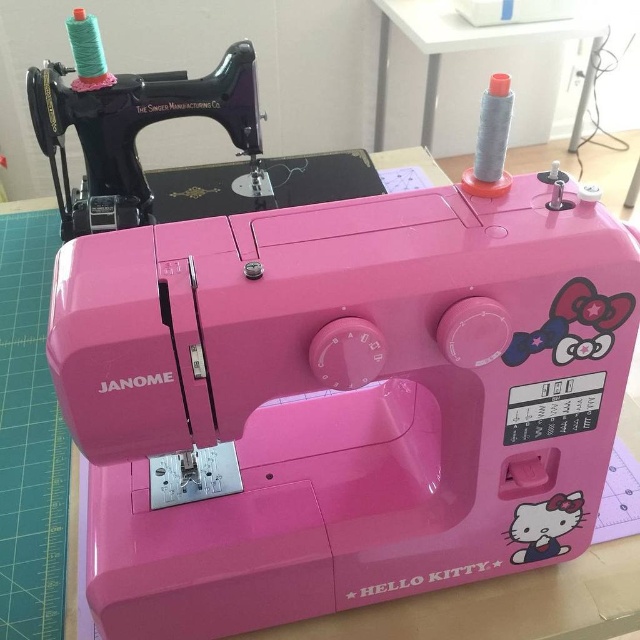
Question: Does pink plastic sewing machine at upper left have a lesser width compared to gray fabric spool at upper right?

Choices:
 (A) no
 (B) yes

Answer: (B)

Question: Which object is closer to the camera taking this photo?

Choices:
 (A) gray fabric spool at upper right
 (B) pink plastic sewing machine at upper left

Answer: (B)

Question: Is pink plastic sewing machine at upper left to the left of gray fabric spool at upper right from the viewer's perspective?

Choices:
 (A) no
 (B) yes

Answer: (B)

Question: Can you confirm if pink plastic sewing machine at upper left is positioned to the right of gray fabric spool at upper right?

Choices:
 (A) yes
 (B) no

Answer: (B)